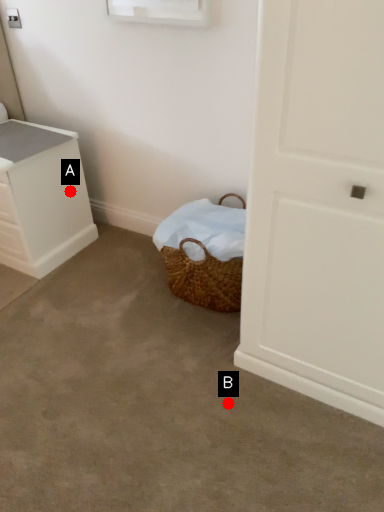
Question: Two points are circled on the image, labeled by A and B beside each circle. Which point appears closest to the camera in this image?

Choices:
 (A) A is closer
 (B) B is closer

Answer: (B)